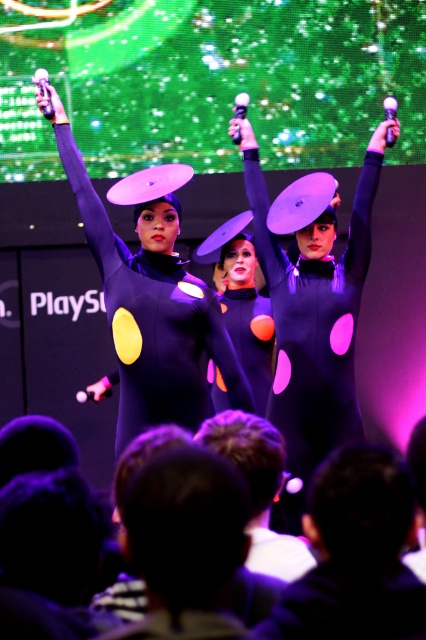
Question: Is black hair at lower center closer to camera compared to purple matte/synthetic costume at center?

Choices:
 (A) no
 (B) yes

Answer: (B)

Question: Is the position of black hair at lower center more distant than that of purple matte/synthetic costume at center?

Choices:
 (A) no
 (B) yes

Answer: (A)

Question: Which is nearer to the black hair at lower center?

Choices:
 (A) matte black costume at center
 (B) purple matte/synthetic costume at center
 (C) black matte head at upper center

Answer: (C)

Question: Estimate the real-world distances between objects in this image. Which object is farther from the matte black costume at center?

Choices:
 (A) purple matte/synthetic costume at center
 (B) black matte head at upper center
 (C) black hair at lower center

Answer: (C)

Question: Which object is farther from the camera taking this photo?

Choices:
 (A) black hair at lower center
 (B) purple matte/synthetic costume at center
 (C) black matte head at upper center

Answer: (B)

Question: Does black hair at lower center appear over purple matte/synthetic costume at center?

Choices:
 (A) no
 (B) yes

Answer: (A)